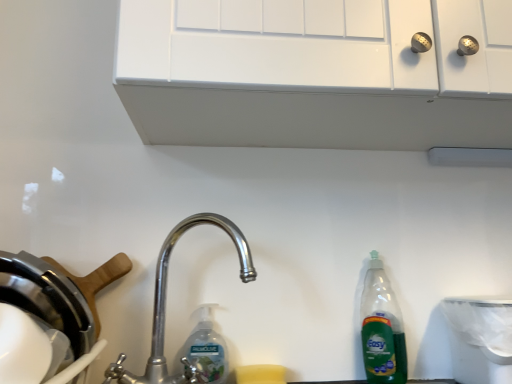
Question: Which is correct: polished metal faucet at center is inside white matte cabinet at upper center, or outside of it?

Choices:
 (A) inside
 (B) outside

Answer: (B)

Question: From the image's perspective, is polished metal faucet at center located above or below white matte cabinet at upper center?

Choices:
 (A) below
 (B) above

Answer: (A)

Question: Which object is positioned farthest from the polished metal faucet at center?

Choices:
 (A) clear plastic bottle at center
 (B) white matte cabinet at upper center
 (C) white plastic trash can at lower right
 (D) green plastic bottle at right

Answer: (C)

Question: Which object is positioned closest to the clear plastic bottle at center?

Choices:
 (A) polished metal faucet at center
 (B) white matte cabinet at upper center
 (C) white plastic trash can at lower right
 (D) green plastic bottle at right

Answer: (A)